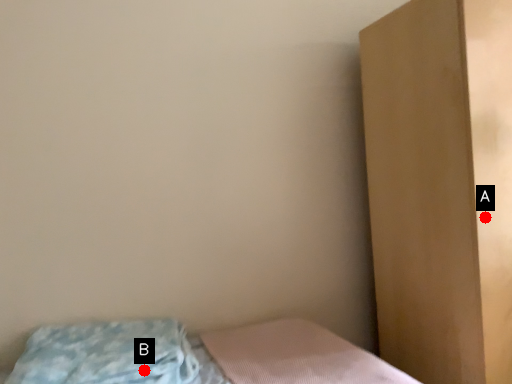
Question: Two points are circled on the image, labeled by A and B beside each circle. Which point is closer to the camera?

Choices:
 (A) A is closer
 (B) B is closer

Answer: (B)